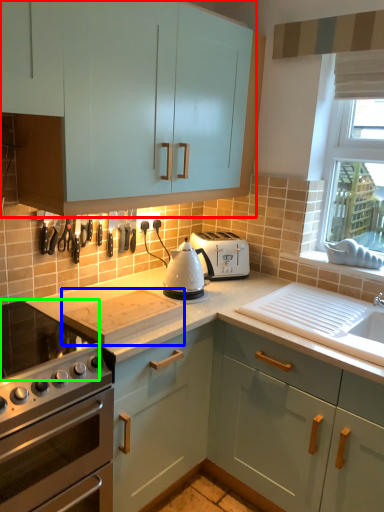
Question: Based on their relative distances, which object is farther from cabinetry (highlighted by a red box)? Choose from appliance (highlighted by a blue box) and gas stove (highlighted by a green box).

Choices:
 (A) appliance
 (B) gas stove

Answer: (B)